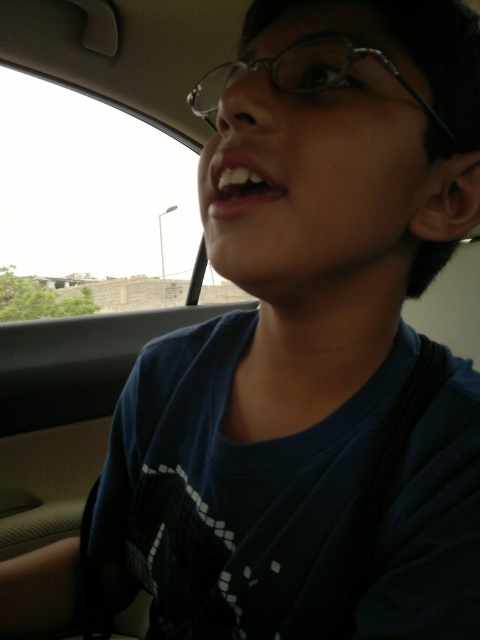
Can you confirm if clear plastic glasses at upper center is positioned below white glossy teeth at upper center?

No.

Is clear plastic glasses at upper center thinner than white glossy teeth at upper center?

In fact, clear plastic glasses at upper center might be wider than white glossy teeth at upper center.

The image size is (480, 640). Find the location of `clear plastic glasses at upper center`. clear plastic glasses at upper center is located at coordinates (316, 77).